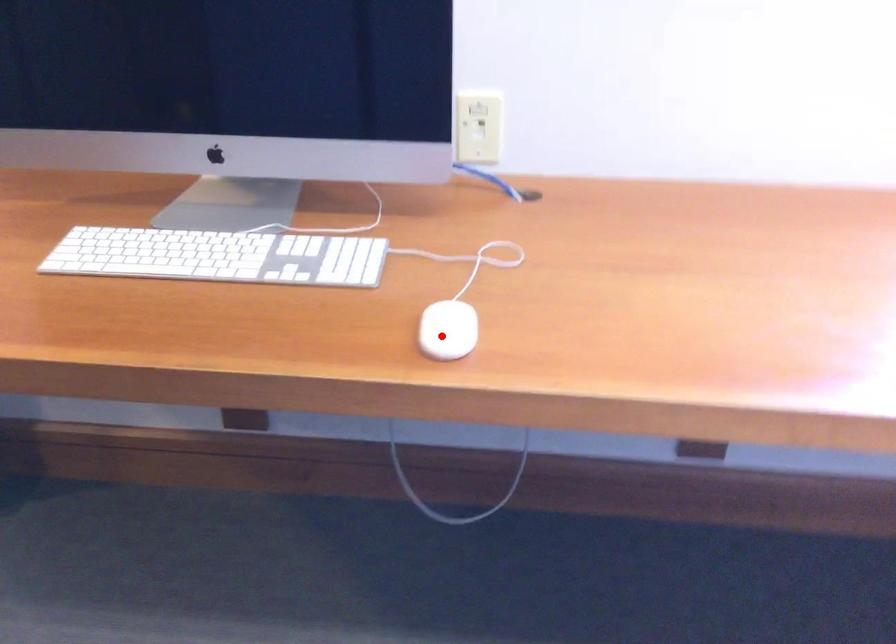
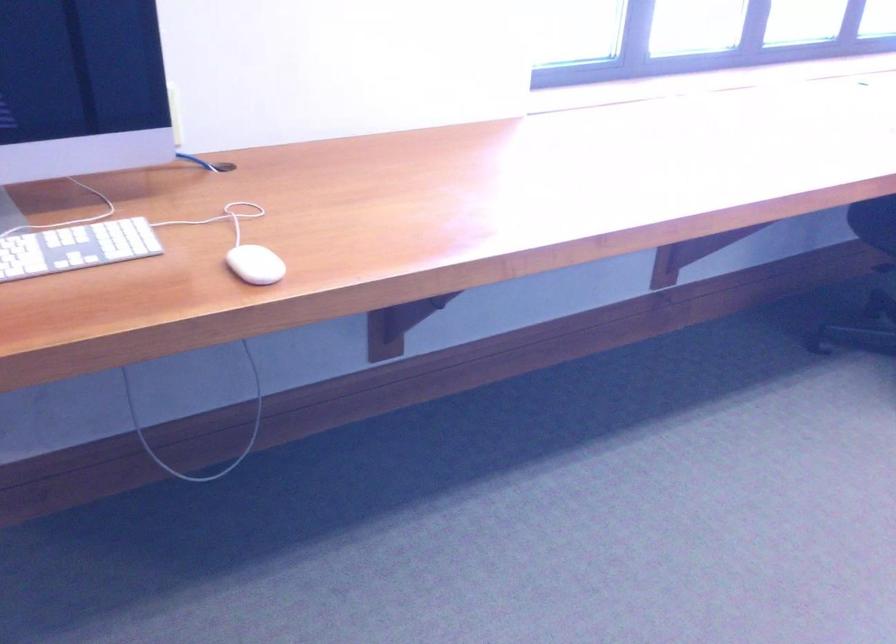
Question: I am providing you with two images of the same scene from different viewpoints. In image1, a red point is highlighted. Considering the same 3D point in image2, which of the following is correct?

Choices:
 (A) It is closer
 (B) It is farther

Answer: (B)